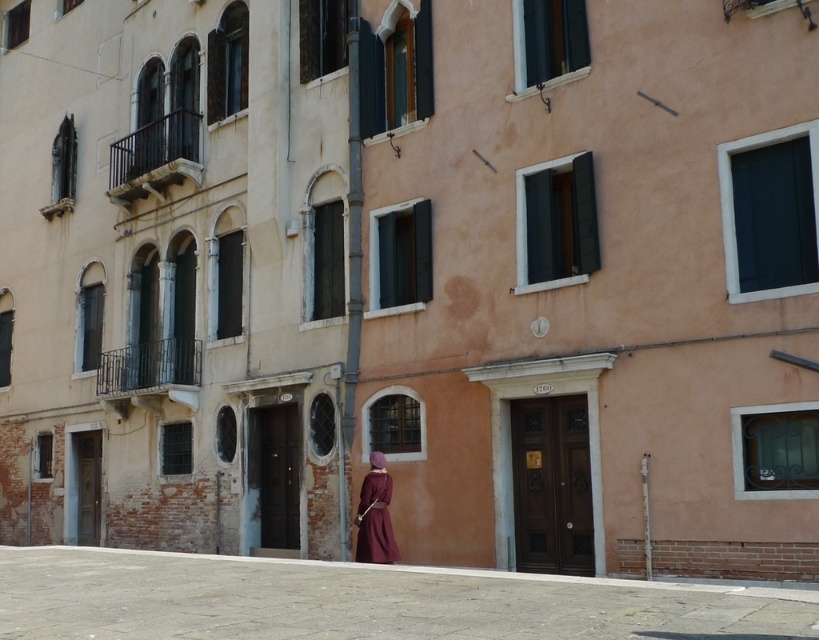
You are standing in the historic European city scene and want to place a small decorative statue exactly where the smooth concrete ground at lower center is located. What are the coordinates where you should place it?

The coordinates for placing the small decorative statue on the smooth concrete ground at lower center are at point (358, 602).

You are a tourist standing at the entrance of the historic building in the image. You want to take a photo of the velvet maroon dress at center without stepping on the smooth concrete ground at lower center. Is it possible to do so while staying in your current position?

The smooth concrete ground at lower center is in front of the velvet maroon dress at center, so you can take the photo without stepping on it by positioning yourself behind the dress.

You are a tourist standing at the entrance of the historic building and want to take a photo of the velvet maroon dress at center. To ensure the dress is centered in the photo, should you adjust your camera angle to focus more on the left or right side of the smooth concrete ground at lower center?

The smooth concrete ground at lower center is wider than the velvet maroon dress at center, so to center the dress in the photo, you should adjust your camera angle to focus more on the left side of the smooth concrete ground at lower center.